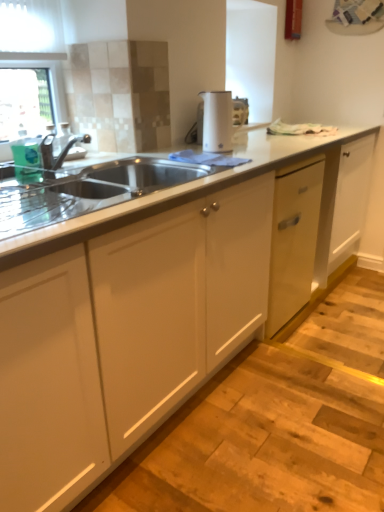
What is the approximate width of white glossy electric kettle at center?

It is 6.86 inches.

What do you see at coordinates (217, 121) in the screenshot?
I see `white glossy electric kettle at center` at bounding box center [217, 121].

What are the coordinates of `white glossy electric kettle at center` in the screenshot? It's located at (217, 121).

The image size is (384, 512). Find the location of `white glossy electric kettle at center`. white glossy electric kettle at center is located at coordinates (217, 121).